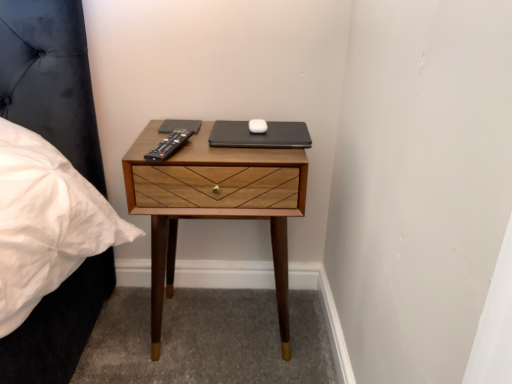
Question: Is black matte laptop at center not inside wooden nightstand at center?

Choices:
 (A) no
 (B) yes

Answer: (A)

Question: From a real-world perspective, does black matte laptop at center stand above wooden nightstand at center?

Choices:
 (A) yes
 (B) no

Answer: (A)

Question: Is black matte laptop at center not near wooden nightstand at center?

Choices:
 (A) no
 (B) yes

Answer: (A)

Question: Does black matte laptop at center have a larger size compared to wooden nightstand at center?

Choices:
 (A) no
 (B) yes

Answer: (A)

Question: Can you confirm if black matte laptop at center is positioned to the left of wooden nightstand at center?

Choices:
 (A) yes
 (B) no

Answer: (B)

Question: Relative to black plastic remote at center, is black matte laptop at center in front or behind?

Choices:
 (A) behind
 (B) front

Answer: (A)

Question: Looking at their shapes, would you say black matte laptop at center is wider or thinner than black plastic remote at center?

Choices:
 (A) thin
 (B) wide

Answer: (A)

Question: From the image's perspective, is black matte laptop at center positioned above or below black plastic remote at center?

Choices:
 (A) below
 (B) above

Answer: (B)

Question: Is black matte laptop at center inside or outside of black plastic remote at center?

Choices:
 (A) inside
 (B) outside

Answer: (B)

Question: Considering the positions of black matte laptop at center and wooden nightstand at center in the image, is black matte laptop at center wider or thinner than wooden nightstand at center?

Choices:
 (A) thin
 (B) wide

Answer: (A)

Question: Does point (225, 120) appear closer or farther from the camera than point (205, 142)?

Choices:
 (A) closer
 (B) farther

Answer: (B)

Question: Is black matte laptop at center in front of or behind wooden nightstand at center in the image?

Choices:
 (A) front
 (B) behind

Answer: (B)

Question: Considering the positions of black matte laptop at center and wooden nightstand at center in the image, is black matte laptop at center bigger or smaller than wooden nightstand at center?

Choices:
 (A) small
 (B) big

Answer: (A)

Question: In the image, is black plastic remote at center positioned in front of or behind wooden nightstand at center?

Choices:
 (A) front
 (B) behind

Answer: (A)

Question: From a real-world perspective, relative to wooden nightstand at center, is black plastic remote at center vertically above or below?

Choices:
 (A) below
 (B) above

Answer: (B)